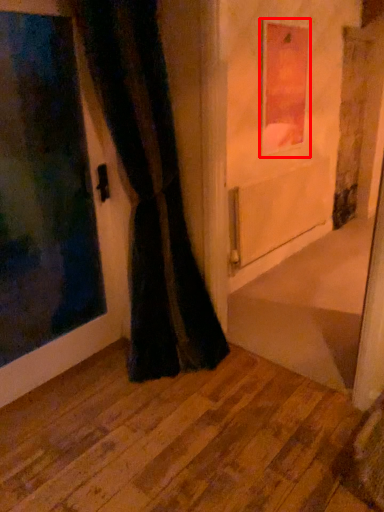
Question: Where is picture frame (annotated by the red box) located in relation to corridor in the image?

Choices:
 (A) right
 (B) left

Answer: (A)